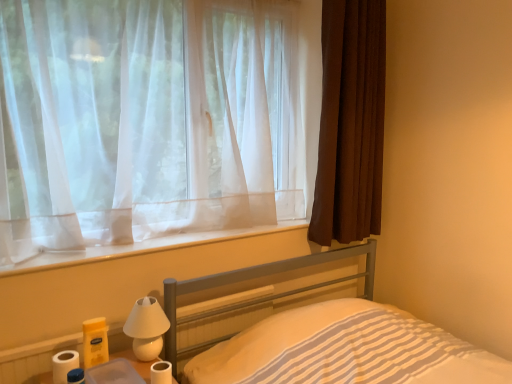
Locate an element on the screen. The width and height of the screenshot is (512, 384). sheer white curtain at upper left, placed as the 1th curtain when sorted from left to right is located at coordinates (151, 120).

Locate an element on the screen. white matte toilet paper at lower left, the 2th toilet paper viewed from the right is located at coordinates coord(64,365).

How much space does white matte toilet paper at lower left, arranged as the 1th toilet paper when viewed from the left, occupy horizontally?

It is 3.61 inches.

What is the approximate width of white matte toilet paper at lower left, the second toilet paper positioned from the left?

white matte toilet paper at lower left, the second toilet paper positioned from the left, is 2.73 inches wide.

Identify the location of white matte toilet paper at lower left, the first toilet paper in the right-to-left sequence. (161, 372).

Identify the location of sheer white curtain at upper left, placed as the 1th curtain when sorted from left to right. The width and height of the screenshot is (512, 384). (151, 120).

Could you tell me if white matte toilet paper at lower left, the second toilet paper positioned from the left, is facing white sheer curtain at upper left?

No, white matte toilet paper at lower left, the second toilet paper positioned from the left, is not turned towards white sheer curtain at upper left.

Considering the positions of objects white matte toilet paper at lower left, the first toilet paper in the right-to-left sequence, and white sheer curtain at upper left in the image provided, who is behind, white matte toilet paper at lower left, the first toilet paper in the right-to-left sequence, or white sheer curtain at upper left?

white sheer curtain at upper left is further away from the camera.

Considering the sizes of white matte toilet paper at lower left, the first toilet paper in the right-to-left sequence, and white sheer curtain at upper left in the image, is white matte toilet paper at lower left, the first toilet paper in the right-to-left sequence, wider or thinner than white sheer curtain at upper left?

Considering their sizes, white matte toilet paper at lower left, the first toilet paper in the right-to-left sequence, looks slimmer than white sheer curtain at upper left.

Is white sheer curtain at upper left completely or partially inside white matte toilet paper at lower left, the second toilet paper positioned from the left?

Actually, white sheer curtain at upper left is outside white matte toilet paper at lower left, the second toilet paper positioned from the left.

Who is bigger, white matte toilet paper at lower left, the second toilet paper positioned from the left, or metallic gray bed at lower center?

With larger size is metallic gray bed at lower center.

From a real-world perspective, between white matte toilet paper at lower left, the first toilet paper in the right-to-left sequence, and metallic gray bed at lower center, who is vertically higher?

white matte toilet paper at lower left, the first toilet paper in the right-to-left sequence, is physically above.

Is white matte toilet paper at lower left, the first toilet paper in the right-to-left sequence, oriented towards metallic gray bed at lower center?

No, white matte toilet paper at lower left, the first toilet paper in the right-to-left sequence, does not turn towards metallic gray bed at lower center.

From the image's perspective, is white matte toilet paper at lower left, the second toilet paper positioned from the left, above or below metallic gray bed at lower center?

From the image's perspective, white matte toilet paper at lower left, the second toilet paper positioned from the left, appears above metallic gray bed at lower center.

Could you tell me if white matte toilet paper at lower left, arranged as the 1th toilet paper when viewed from the left, is facing white matte bedside lamp at lower left?

No, white matte toilet paper at lower left, arranged as the 1th toilet paper when viewed from the left, does not turn towards white matte bedside lamp at lower left.

Is point (59, 363) positioned behind point (155, 301)?

No, (59, 363) is in front of (155, 301).

Can you confirm if white matte toilet paper at lower left, arranged as the 1th toilet paper when viewed from the left, is thinner than white matte bedside lamp at lower left?

Correct, the width of white matte toilet paper at lower left, arranged as the 1th toilet paper when viewed from the left, is less than that of white matte bedside lamp at lower left.

Is white matte toilet paper at lower left, the 2th toilet paper viewed from the right, not inside white matte bedside lamp at lower left?

Yes, white matte toilet paper at lower left, the 2th toilet paper viewed from the right, is not within white matte bedside lamp at lower left.

In the scene shown: Is metallic gray bed at lower center inside the boundaries of white matte toilet paper at lower left, the first toilet paper in the right-to-left sequence, or outside?

metallic gray bed at lower center cannot be found inside white matte toilet paper at lower left, the first toilet paper in the right-to-left sequence.

Does metallic gray bed at lower center turn towards white matte toilet paper at lower left, the first toilet paper in the right-to-left sequence?

No, metallic gray bed at lower center is not oriented towards white matte toilet paper at lower left, the first toilet paper in the right-to-left sequence.

From the image's perspective, which is below, metallic gray bed at lower center or white matte toilet paper at lower left, the first toilet paper in the right-to-left sequence?

metallic gray bed at lower center.

Is the surface of sheer white curtain at upper left, placed as the 1th curtain when sorted from left to right, in direct contact with white matte toilet paper at lower left, the 2th toilet paper viewed from the right?

No.

From the image's perspective, which is below, sheer white curtain at upper left, placed as the 1th curtain when sorted from left to right, or white matte toilet paper at lower left, arranged as the 1th toilet paper when viewed from the left?

white matte toilet paper at lower left, arranged as the 1th toilet paper when viewed from the left, from the image's perspective.

Is sheer white curtain at upper left, placed as the 1th curtain when sorted from left to right, looking in the opposite direction of white matte toilet paper at lower left, the 2th toilet paper viewed from the right?

No, sheer white curtain at upper left, placed as the 1th curtain when sorted from left to right, is not facing away from white matte toilet paper at lower left, the 2th toilet paper viewed from the right.

Considering the sizes of objects sheer white curtain at upper left, the second curtain when ordered from right to left, and white matte toilet paper at lower left, arranged as the 1th toilet paper when viewed from the left, in the image provided, who is shorter, sheer white curtain at upper left, the second curtain when ordered from right to left, or white matte toilet paper at lower left, arranged as the 1th toilet paper when viewed from the left,?

Standing shorter between the two is white matte toilet paper at lower left, arranged as the 1th toilet paper when viewed from the left.

From the image's perspective, which is below, brown textured curtain at right, acting as the second curtain starting from the left, or metallic gray bed at lower center?

metallic gray bed at lower center appears lower in the image.

Can you tell me how much brown textured curtain at right, the 1th curtain when ordered from right to left, and metallic gray bed at lower center differ in facing direction?

The angular difference between brown textured curtain at right, the 1th curtain when ordered from right to left, and metallic gray bed at lower center is 0.672 degrees.

The width and height of the screenshot is (512, 384). In the image, there is a brown textured curtain at right, acting as the second curtain starting from the left. Find the location of `bed below it (from the image's perspective)`. bed below it (from the image's perspective) is located at coordinates (345, 350).

Is white matte toilet paper at lower left, arranged as the 1th toilet paper when viewed from the left, facing towards white sheer curtain at upper left?

No, white matte toilet paper at lower left, arranged as the 1th toilet paper when viewed from the left, is not facing towards white sheer curtain at upper left.

Measure the distance from white matte toilet paper at lower left, the 2th toilet paper viewed from the right, to white sheer curtain at upper left.

white matte toilet paper at lower left, the 2th toilet paper viewed from the right, is 20.48 inches away from white sheer curtain at upper left.

Which of these two, white matte toilet paper at lower left, arranged as the 1th toilet paper when viewed from the left, or white sheer curtain at upper left, stands shorter?

white sheer curtain at upper left.

Choose the correct answer: Is white matte toilet paper at lower left, the 2th toilet paper viewed from the right, inside white sheer curtain at upper left or outside it?

white matte toilet paper at lower left, the 2th toilet paper viewed from the right, is not enclosed by white sheer curtain at upper left.

You are a GUI agent. You are given a task and a screenshot of the screen. Output one action in this format:
    pyautogui.click(x=<x>, y=<y>)
    Task: Click on the window sill behind the white matte toilet paper at lower left, the first toilet paper in the right-to-left sequence
    This screenshot has height=384, width=512.
    Given the screenshot: What is the action you would take?
    pyautogui.click(x=142, y=247)

Where is `bed on the right side of white matte toilet paper at lower left, the first toilet paper in the right-to-left sequence`? The width and height of the screenshot is (512, 384). bed on the right side of white matte toilet paper at lower left, the first toilet paper in the right-to-left sequence is located at coordinates (345, 350).

From the image, which object appears to be farther from white matte toilet paper at lower left, the second toilet paper positioned from the left, white matte bedside lamp at lower left or white matte toilet paper at lower left, the 2th toilet paper viewed from the right?

white matte toilet paper at lower left, the 2th toilet paper viewed from the right, is positioned further to the anchor white matte toilet paper at lower left, the second toilet paper positioned from the left.

Considering their positions, is white matte toilet paper at lower left, arranged as the 1th toilet paper when viewed from the left, positioned closer to white matte toilet paper at lower left, the second toilet paper positioned from the left, than clear plastic container at lower left?

clear plastic container at lower left is closer to white matte toilet paper at lower left, the second toilet paper positioned from the left.

Based on their spatial positions, is brown textured curtain at right, acting as the second curtain starting from the left, or white matte toilet paper at lower left, the 2th toilet paper viewed from the right, further from white matte bedside lamp at lower left?

brown textured curtain at right, acting as the second curtain starting from the left.

Looking at the image, which one is located closer to metallic gray bed at lower center, white matte bedside lamp at lower left or clear plastic container at lower left?

Based on the image, white matte bedside lamp at lower left appears to be nearer to metallic gray bed at lower center.

Considering their positions, is white matte bedside lamp at lower left positioned further to white matte toilet paper at lower left, arranged as the 1th toilet paper when viewed from the left, than clear plastic container at lower left?

white matte bedside lamp at lower left lies further to white matte toilet paper at lower left, arranged as the 1th toilet paper when viewed from the left, than the other object.

Estimate the real-world distances between objects in this image. Which object is further from sheer white curtain at upper left, placed as the 1th curtain when sorted from left to right, white matte toilet paper at lower left, the first toilet paper in the right-to-left sequence, or metallic gray bed at lower center?

white matte toilet paper at lower left, the first toilet paper in the right-to-left sequence.

Estimate the real-world distances between objects in this image. Which object is further from clear plastic container at lower left, brown textured curtain at right, acting as the second curtain starting from the left, or white matte toilet paper at lower left, the 2th toilet paper viewed from the right?

The object further to clear plastic container at lower left is brown textured curtain at right, acting as the second curtain starting from the left.

Considering their positions, is metallic gray bed at lower center positioned closer to brown textured curtain at right, acting as the second curtain starting from the left, than white matte bedside lamp at lower left?

Among the two, metallic gray bed at lower center is located nearer to brown textured curtain at right, acting as the second curtain starting from the left.

At what (x,y) coordinates should I click in order to perform the action: click on bedside lamp between brown textured curtain at right, the 1th curtain when ordered from right to left, and clear plastic container at lower left from top to bottom. Please return your answer as a coordinate pair (x, y). This screenshot has height=384, width=512. Looking at the image, I should click on (146, 328).

Identify the location of curtain situated between white matte toilet paper at lower left, arranged as the 1th toilet paper when viewed from the left, and brown textured curtain at right, acting as the second curtain starting from the left, from left to right. This screenshot has width=512, height=384. (151, 120).

The image size is (512, 384). I want to click on window sill situated between white matte toilet paper at lower left, arranged as the 1th toilet paper when viewed from the left, and brown textured curtain at right, the 1th curtain when ordered from right to left, from left to right, so click(142, 247).

This screenshot has width=512, height=384. What are the coordinates of `bedside lamp between white sheer curtain at upper left and white matte toilet paper at lower left, arranged as the 1th toilet paper when viewed from the left, in the vertical direction` in the screenshot? It's located at (146, 328).